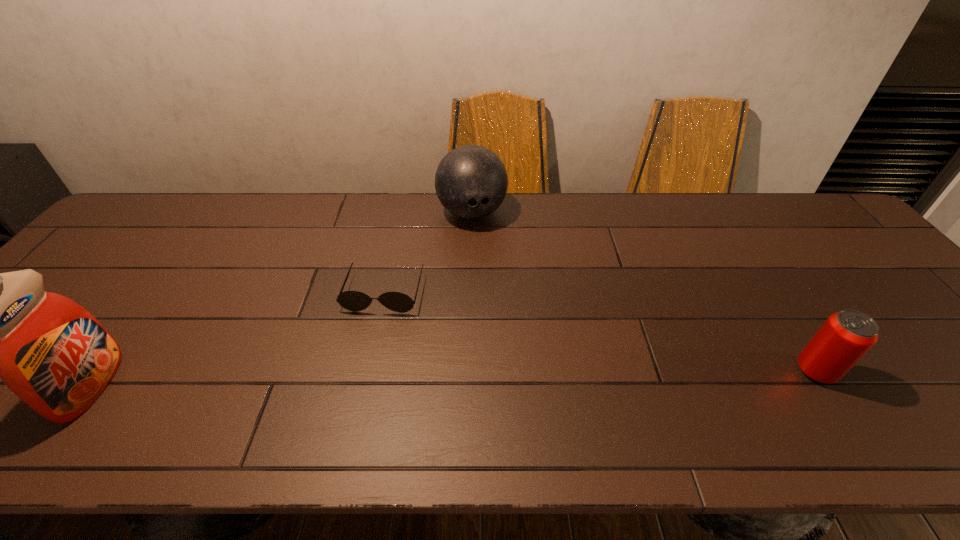
In the image, there is a desktop. What are the coordinates of `vacant space at the near edge` in the screenshot? It's located at (541, 397).

In order to click on free location at the left edge in this screenshot , I will do `click(110, 247)`.

Where is `vacant space at the right edge of the desktop`? The height and width of the screenshot is (540, 960). vacant space at the right edge of the desktop is located at coordinates (859, 262).

This screenshot has width=960, height=540. I want to click on free space at the far right corner, so click(x=800, y=208).

Find the location of `unoccupied area between the tallest object and the second object from left to right`. unoccupied area between the tallest object and the second object from left to right is located at coordinates (238, 339).

The height and width of the screenshot is (540, 960). Find the location of `free space between the second tallest object and the can`. free space between the second tallest object and the can is located at coordinates (643, 292).

Find the location of a particular element. This screenshot has width=960, height=540. empty space between the leftmost object and the rightmost object is located at coordinates (453, 378).

You are a GUI agent. You are given a task and a screenshot of the screen. Output one action in this format:
    pyautogui.click(x=<x>, y=<y>)
    Task: Click on the empty space between the rightmost object and the farthest object
    The height and width of the screenshot is (540, 960).
    Given the screenshot: What is the action you would take?
    pyautogui.click(x=643, y=292)

The height and width of the screenshot is (540, 960). I want to click on blank region between the tallest object and the bowling ball, so click(282, 299).

The image size is (960, 540). Find the location of `free spot between the tallest object and the third nearest object`. free spot between the tallest object and the third nearest object is located at coordinates (238, 339).